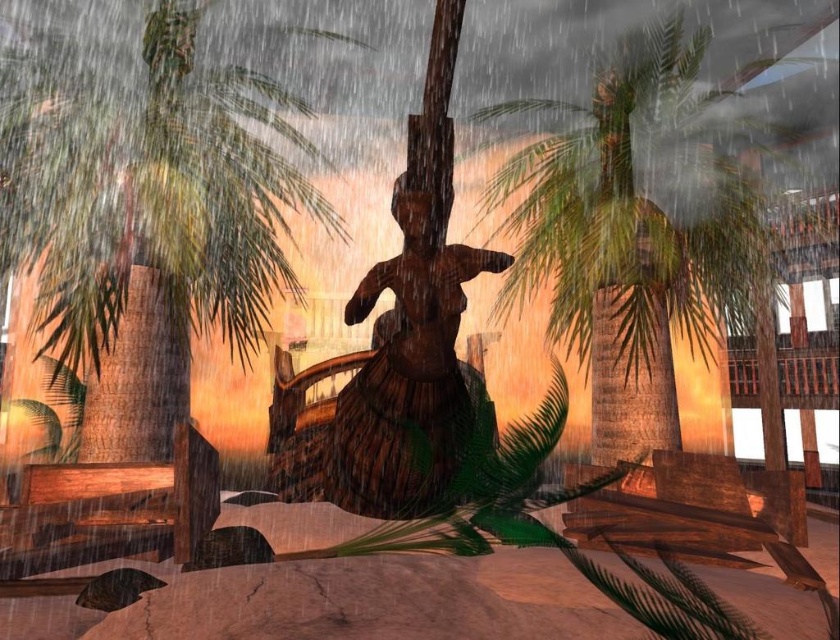
You are a photographer standing at point (140,202). You want to capture a photo of the statue of a person in a traditional hula pose at the center. However, there is an obstacle blocking your view. What is the obstacle?

The obstacle is the green leafy palm tree at left located at point (140,202), which is blocking the view to the statue of a person in a traditional hula pose at the center.

You are standing at the center of the scene and want to move towards the green leafy palm tree at left. Which direction should you face to walk straight towards it?

The green leafy palm tree at left is located at point (140, 202), so you should face towards the left direction to walk straight towards it.